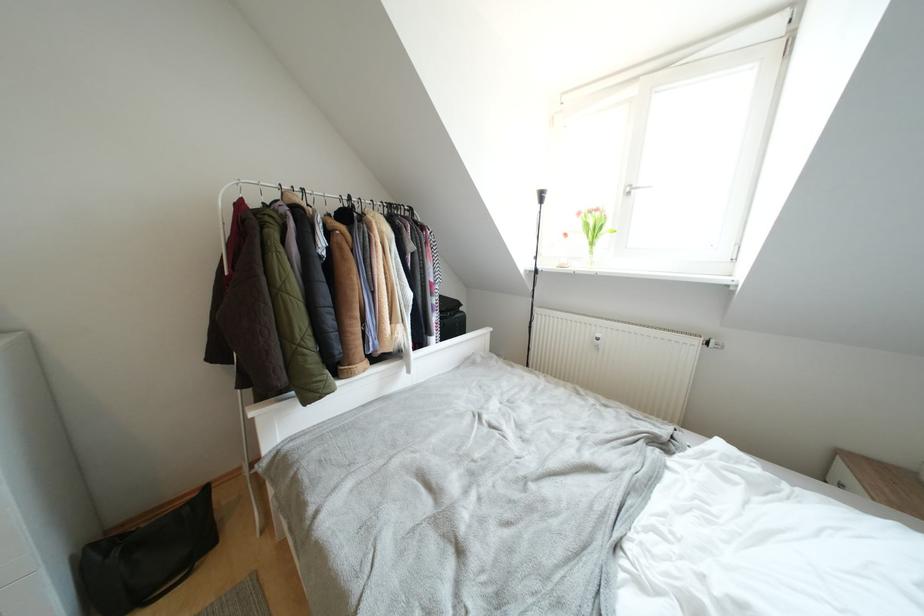
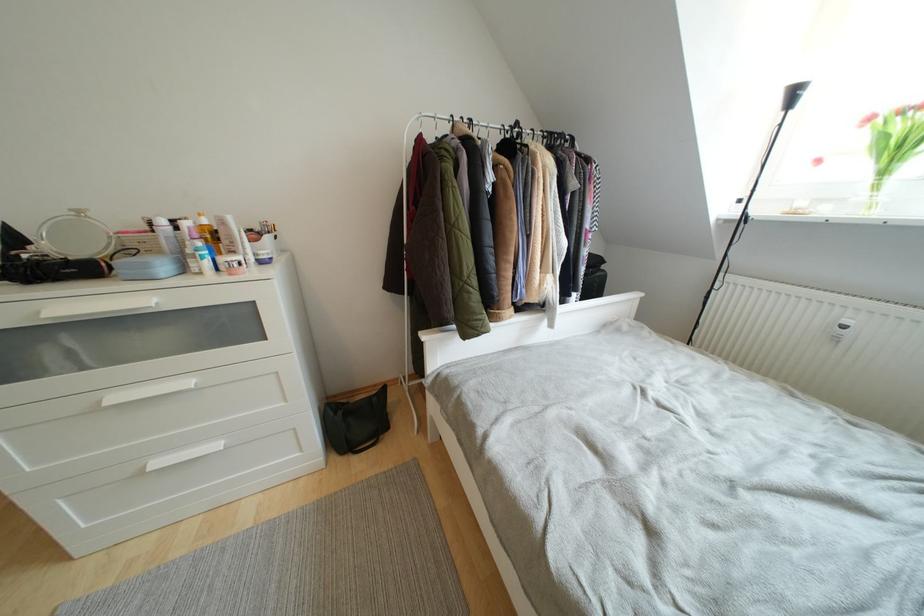
Where in the second image is the point corresponding to pixel 597 248 from the first image?

(890, 176)